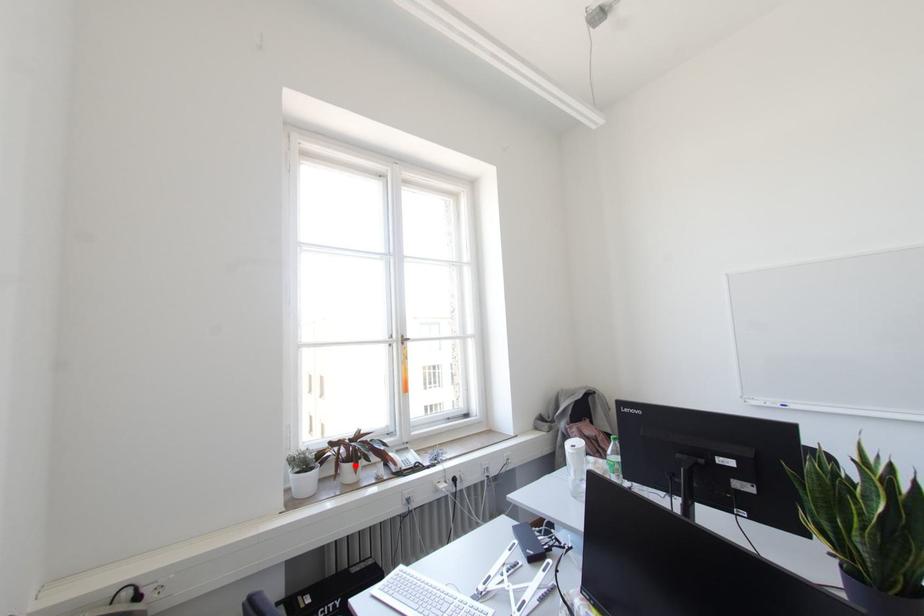
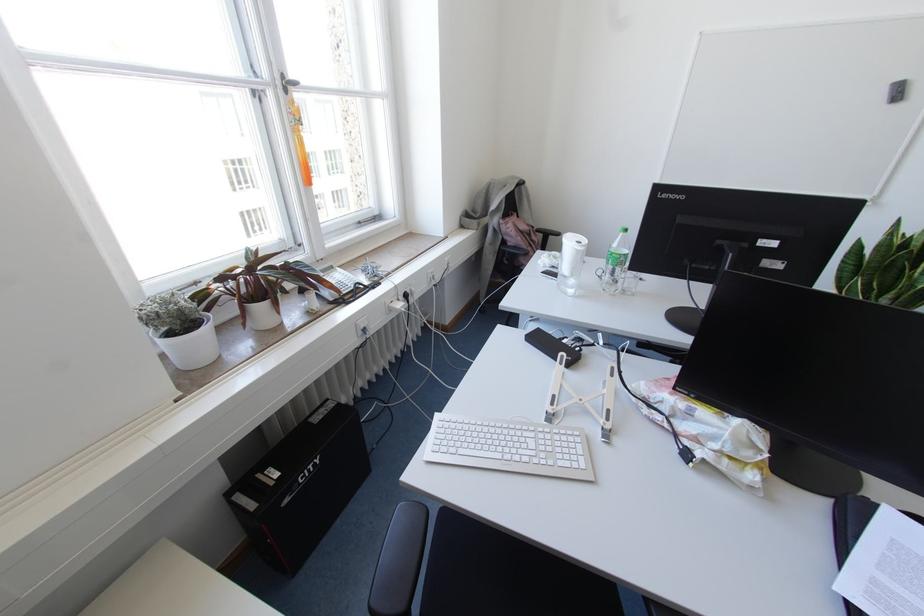
Where in the second image is the point corresponding to the highlighted location from the first image?

(274, 302)